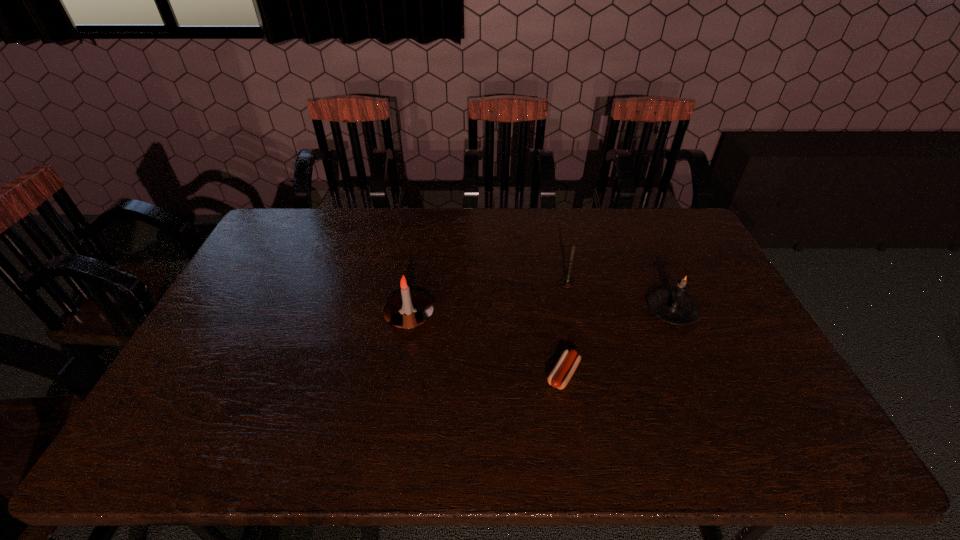
This screenshot has width=960, height=540. I want to click on vacant region between the rightmost candle and the nearest object, so click(x=618, y=343).

In order to click on free spot between the nearest object and the leftmost object in this screenshot , I will do `click(486, 345)`.

You are a GUI agent. You are given a task and a screenshot of the screen. Output one action in this format:
    pyautogui.click(x=<x>, y=<y>)
    Task: Click on the unoccupied position between the rightmost candle and the nearest object
    Image resolution: width=960 pixels, height=540 pixels.
    Given the screenshot: What is the action you would take?
    pyautogui.click(x=618, y=343)

Identify the location of free area in between the rightmost candle and the leftmost candle. (540, 314).

Where is `vacant region between the sausage and the rightmost candle`? vacant region between the sausage and the rightmost candle is located at coordinates (618, 343).

Identify the location of object that ranks as the third closest to the second candle from right to left. The width and height of the screenshot is (960, 540). tap(407, 310).

This screenshot has height=540, width=960. I want to click on object that is the closest to the shortest object, so click(674, 306).

Find the location of `the closest candle to the farthest candle`. the closest candle to the farthest candle is located at coordinates (674, 306).

Point out which candle is positioned as the nearest to the farthest object. Please provide its 2D coordinates. Your answer should be formatted as a tuple, i.e. [(x, y)], where the tuple contains the x and y coordinates of a point satisfying the conditions above.

[(674, 306)]

Identify the location of vacant space that satisfies the following two spatial constraints: 1. on the back side of the leftmost object; 2. on the right side of the farthest candle. (415, 283).